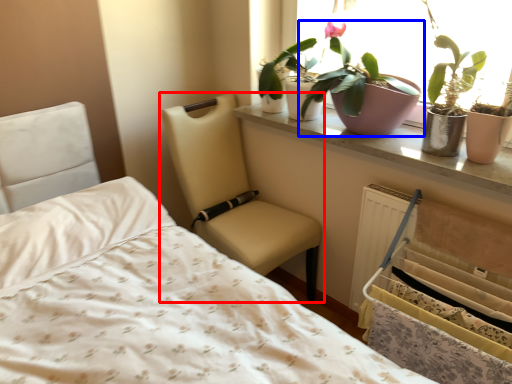
Question: Which object appears farthest to the camera in this image, chair (highlighted by a red box) or houseplant (highlighted by a blue box)?

Choices:
 (A) chair
 (B) houseplant

Answer: (A)